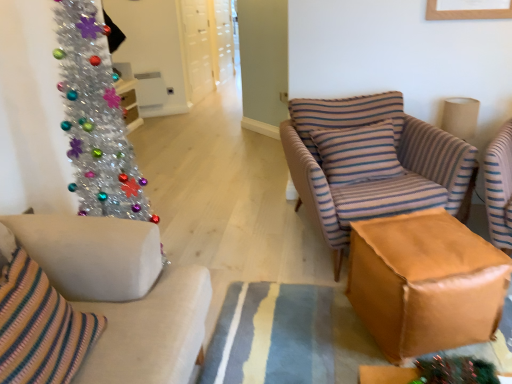
Question: Should I look upward or downward to see shiny metallic christmas tree at left?

Choices:
 (A) down
 (B) up

Answer: (B)

Question: Should I look upward or downward to see striped fabric armchair at center?

Choices:
 (A) down
 (B) up

Answer: (B)

Question: Is shiny metallic christmas tree at left not inside striped fabric armchair at center?

Choices:
 (A) yes
 (B) no

Answer: (A)

Question: Is shiny metallic christmas tree at left facing towards striped fabric armchair at center?

Choices:
 (A) yes
 (B) no

Answer: (B)

Question: Is shiny metallic christmas tree at left bigger than striped fabric armchair at center?

Choices:
 (A) yes
 (B) no

Answer: (B)

Question: Can striped fabric armchair at center be found inside shiny metallic christmas tree at left?

Choices:
 (A) yes
 (B) no

Answer: (B)

Question: Considering the relative positions of shiny metallic christmas tree at left and striped fabric armchair at center in the image provided, is shiny metallic christmas tree at left to the left of striped fabric armchair at center from the viewer's perspective?

Choices:
 (A) yes
 (B) no

Answer: (A)

Question: Considering the relative positions of shiny metallic christmas tree at left and striped fabric armchair at center in the image provided, is shiny metallic christmas tree at left behind striped fabric armchair at center?

Choices:
 (A) yes
 (B) no

Answer: (B)

Question: Is striped fabric armchair at center behind striped fabric pillow at center?

Choices:
 (A) no
 (B) yes

Answer: (A)

Question: Are striped fabric armchair at center and striped fabric pillow at center located far from each other?

Choices:
 (A) no
 (B) yes

Answer: (A)

Question: Is striped fabric armchair at center thinner than striped fabric pillow at center?

Choices:
 (A) no
 (B) yes

Answer: (A)

Question: Can you confirm if striped fabric armchair at center is positioned to the left of striped fabric pillow at center?

Choices:
 (A) yes
 (B) no

Answer: (B)

Question: Is striped fabric armchair at center wider than striped fabric pillow at center?

Choices:
 (A) no
 (B) yes

Answer: (B)

Question: From a real-world perspective, is striped fabric armchair at center located higher than striped fabric pillow at center?

Choices:
 (A) yes
 (B) no

Answer: (B)

Question: Is the position of shiny metallic christmas tree at left more distant than that of brown leather ottoman at center?

Choices:
 (A) yes
 (B) no

Answer: (B)